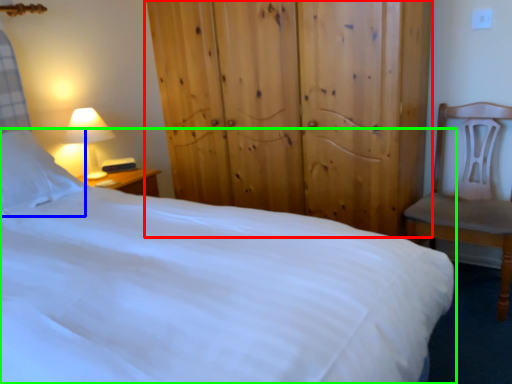
Question: Which is farther away from dresser (highlighted by a red box)? pillow (highlighted by a blue box) or bed (highlighted by a green box)?

Choices:
 (A) pillow
 (B) bed

Answer: (A)